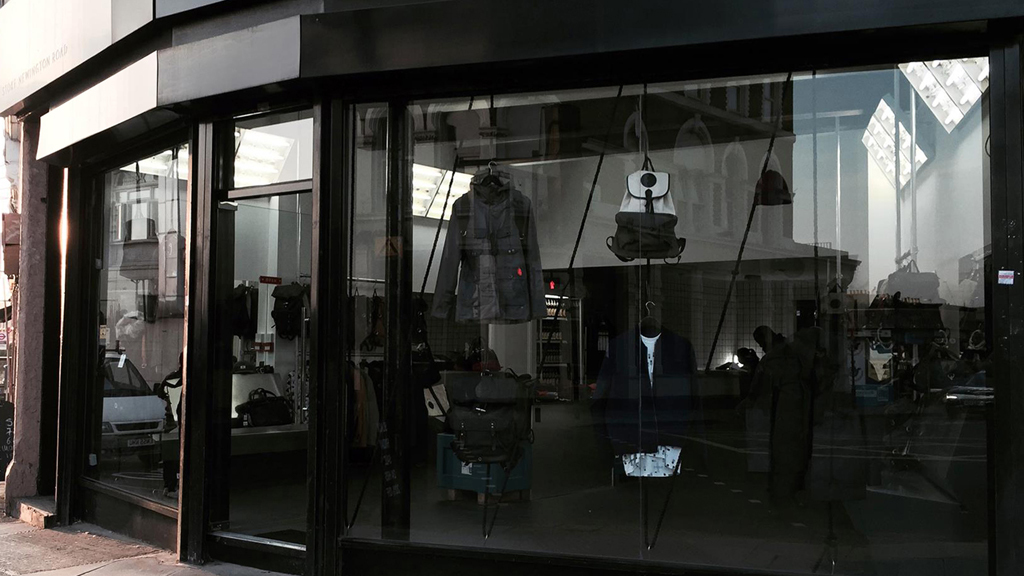
Locate an element on the screen. This screenshot has width=1024, height=576. clothing store is located at coordinates (578, 350).